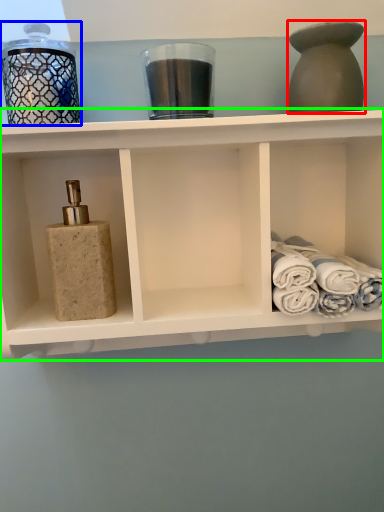
Question: Which object is positioned closest to bottle (highlighted by a red box)? Select from glass jar (highlighted by a blue box) and shelf (highlighted by a green box).

Choices:
 (A) glass jar
 (B) shelf

Answer: (B)